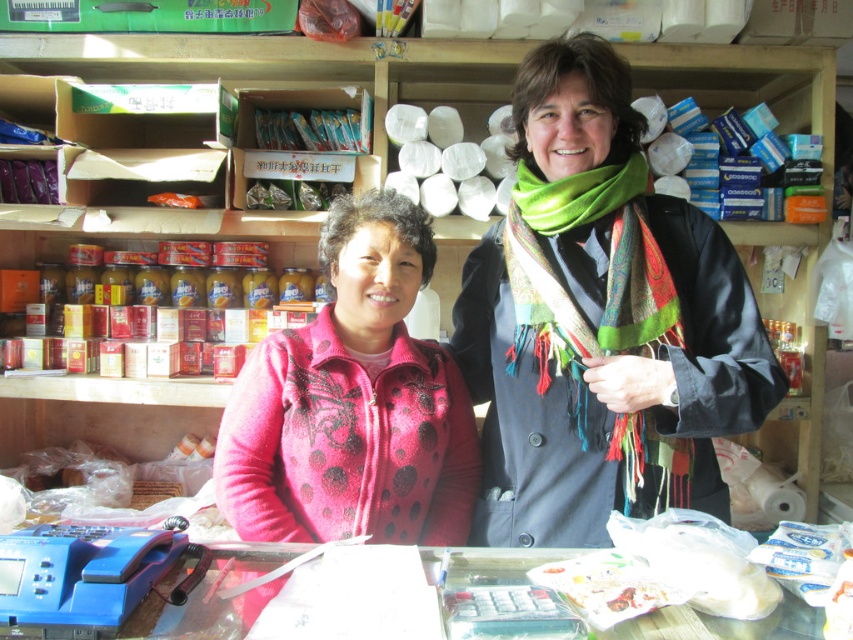
Question: Which point is closer to the camera?

Choices:
 (A) [563, 172]
 (B) [645, 340]
 (C) [254, 368]

Answer: (B)

Question: Is multicolored scarf at center below pink dotted sweater at center?

Choices:
 (A) no
 (B) yes

Answer: (A)

Question: Which point is farther to the camera?

Choices:
 (A) green woven scarf at center
 (B) multicolored scarf at center

Answer: (A)

Question: Which of the following is the closest to the observer?

Choices:
 (A) pink dotted sweater at center
 (B) multicolored scarf at center
 (C) green woven scarf at center

Answer: (B)

Question: Can you confirm if multicolored scarf at center is positioned below green woven scarf at center?

Choices:
 (A) yes
 (B) no

Answer: (B)

Question: Does pink dotted sweater at center come in front of green woven scarf at center?

Choices:
 (A) yes
 (B) no

Answer: (B)